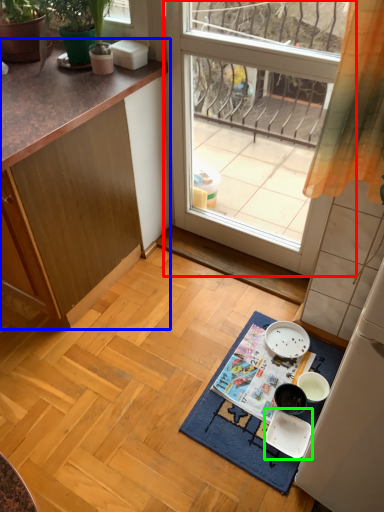
Question: Which is nearer to the window (highlighted by a red box)? cabinetry (highlighted by a blue box) or tableware (highlighted by a green box).

Choices:
 (A) cabinetry
 (B) tableware

Answer: (A)